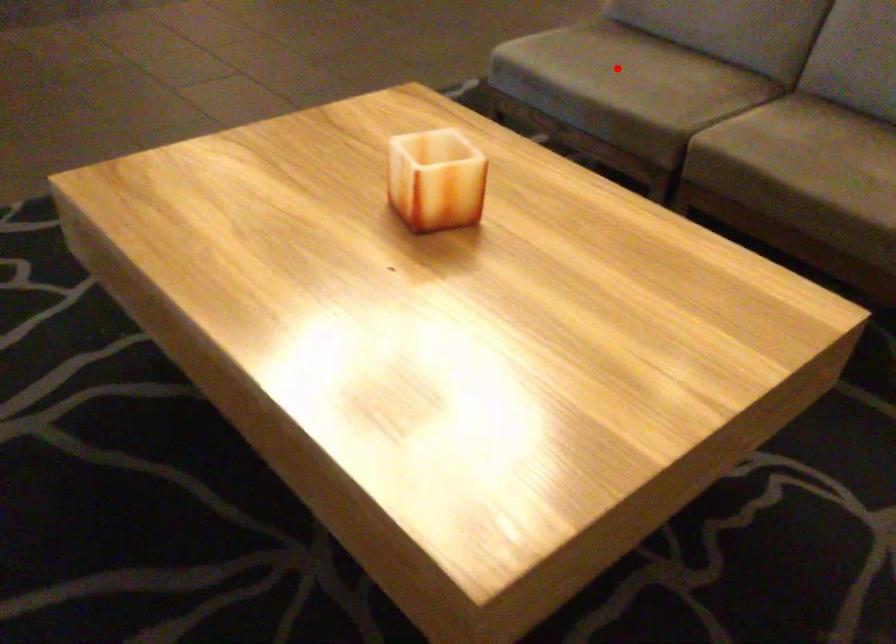
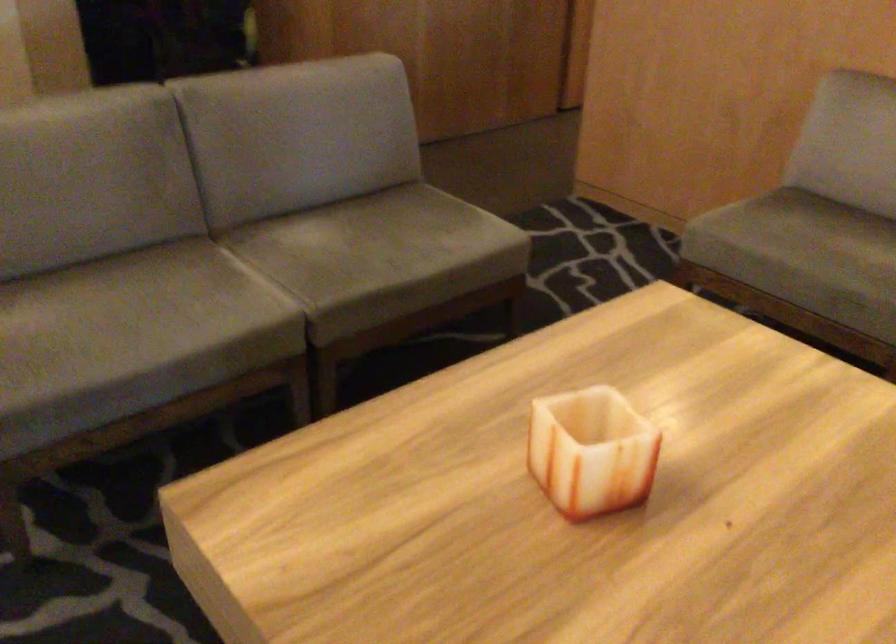
Find the pixel in the second image that matches the highlighted location in the first image.

(139, 322)